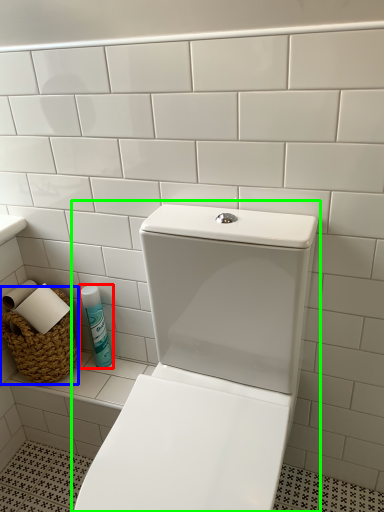
Question: Which object is positioned closest to cleaning product (highlighted by a red box)? Select from basket (highlighted by a blue box) and toilet (highlighted by a green box).

Choices:
 (A) basket
 (B) toilet

Answer: (A)